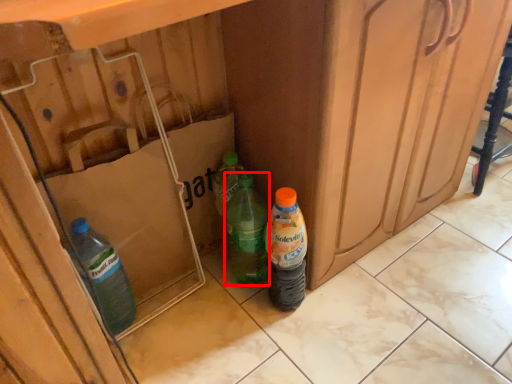
Question: Considering the relative positions of bottle (annotated by the red box) and bottle in the image provided, where is bottle (annotated by the red box) located with respect to the staircase?

Choices:
 (A) right
 (B) left

Answer: (B)